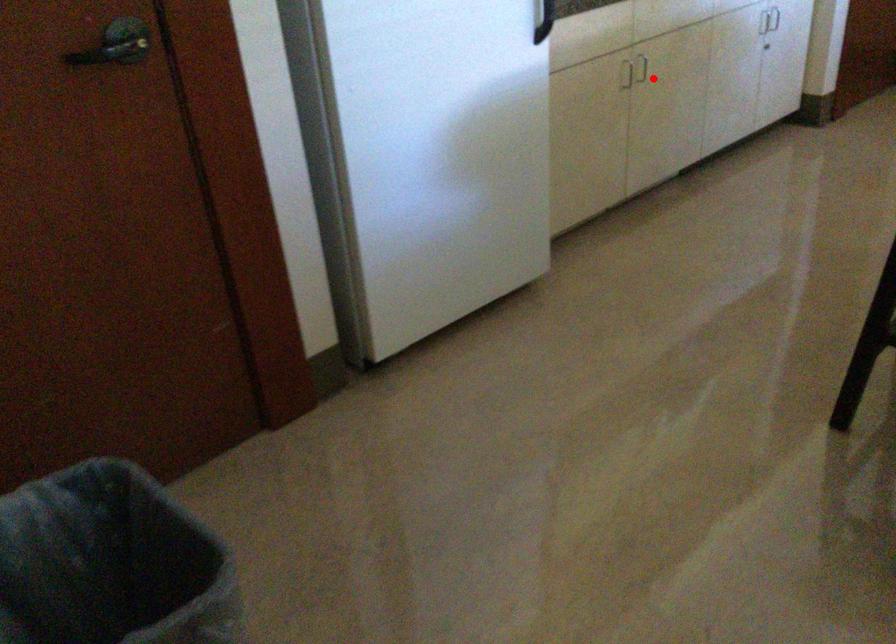
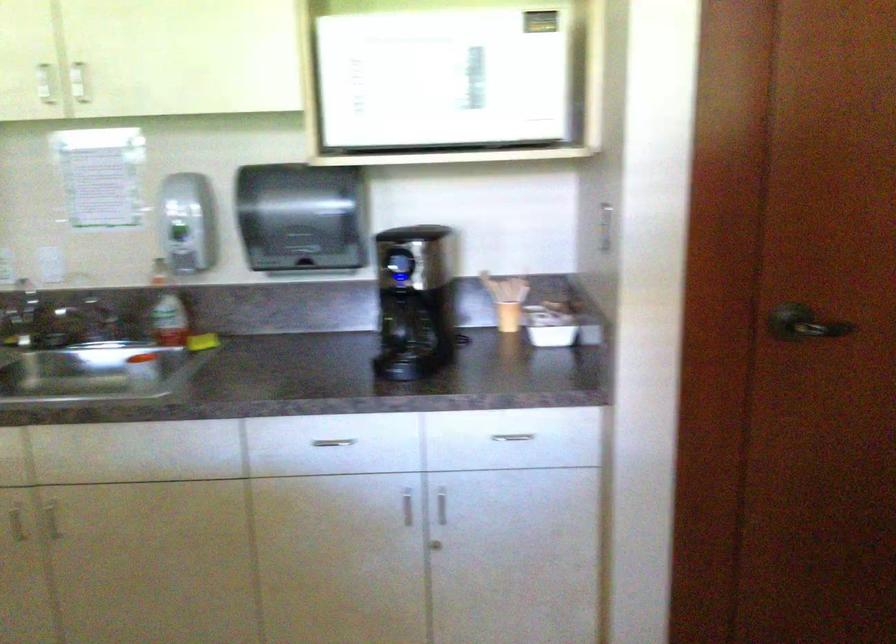
Where in the second image is the point corresponding to the highlighted location from the first image?

(52, 520)